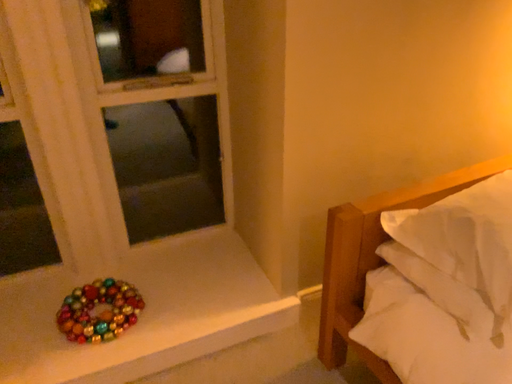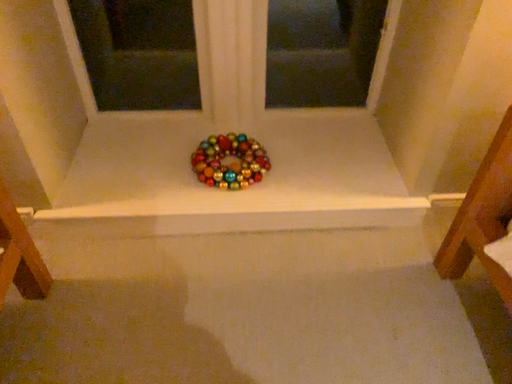
Question: Which way did the camera rotate in the video?

Choices:
 (A) rotated downward
 (B) rotated upward

Answer: (A)